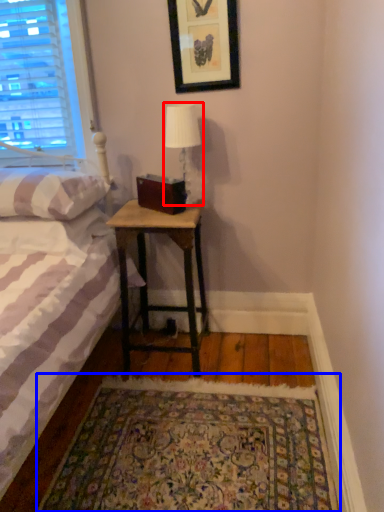
Question: Which object is further to the camera taking this photo, table lamp (highlighted by a red box) or mat (highlighted by a blue box)?

Choices:
 (A) table lamp
 (B) mat

Answer: (A)